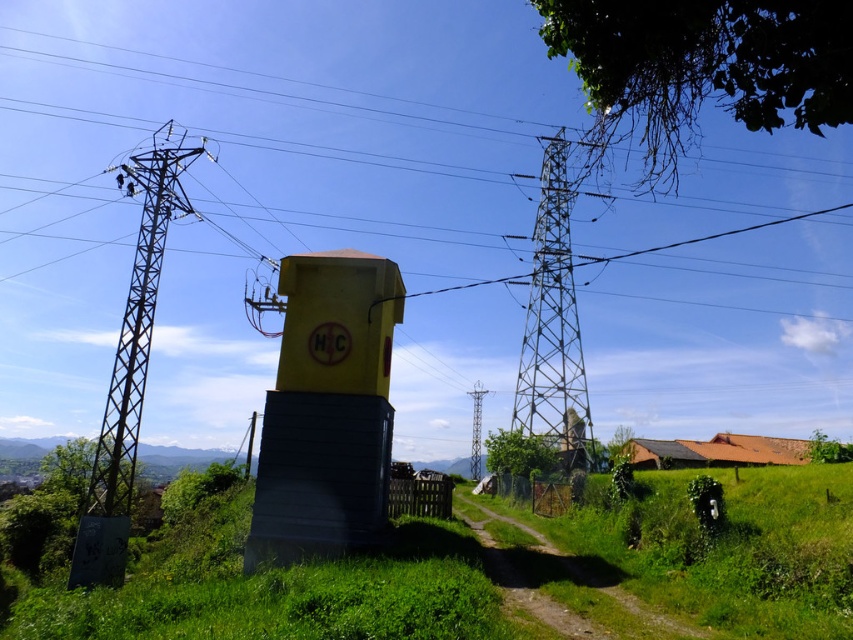
Based on the photo, you are a bird flying over the rural landscape. You see the metallic gray tower at left and the metallic yellow water tower at center. Which tower is located to the left of the other?

The metallic gray tower at left is positioned on the right side of the metallic yellow water tower at center, so the metallic yellow water tower at center is to the left of the metallic gray tower at left.

You are a maintenance worker needing to inspect both the yellow matte water tower at center and the metallic yellow water tower at center. The safety protocol requires you to stay at least 40 meters away from any active tower. Can you safely approach both towers simultaneously?

The distance between the yellow matte water tower at center and the metallic yellow water tower at center is 40.75 meters. Since the required safety distance is 40 meters, you can safely approach both towers simultaneously as the distance between them exceeds the minimum requirement.